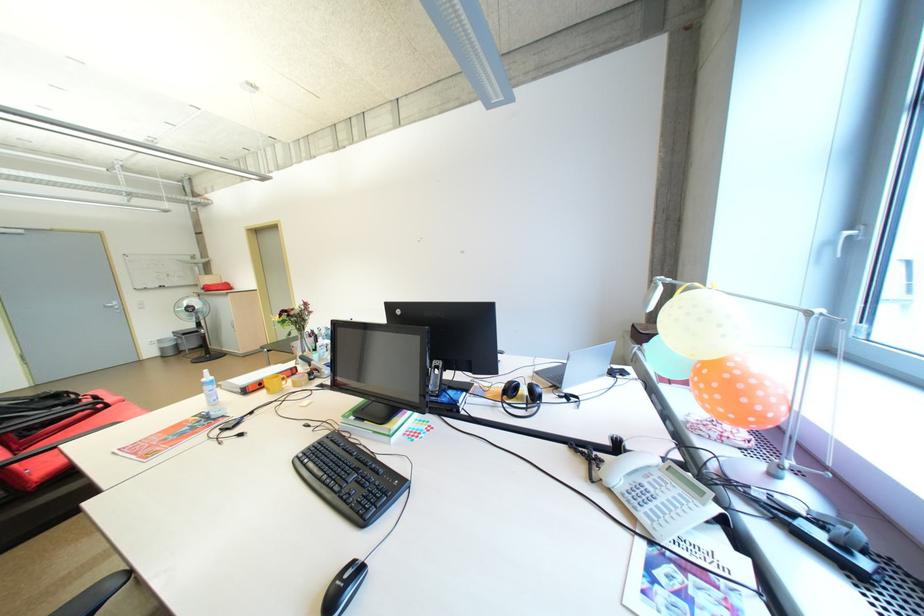
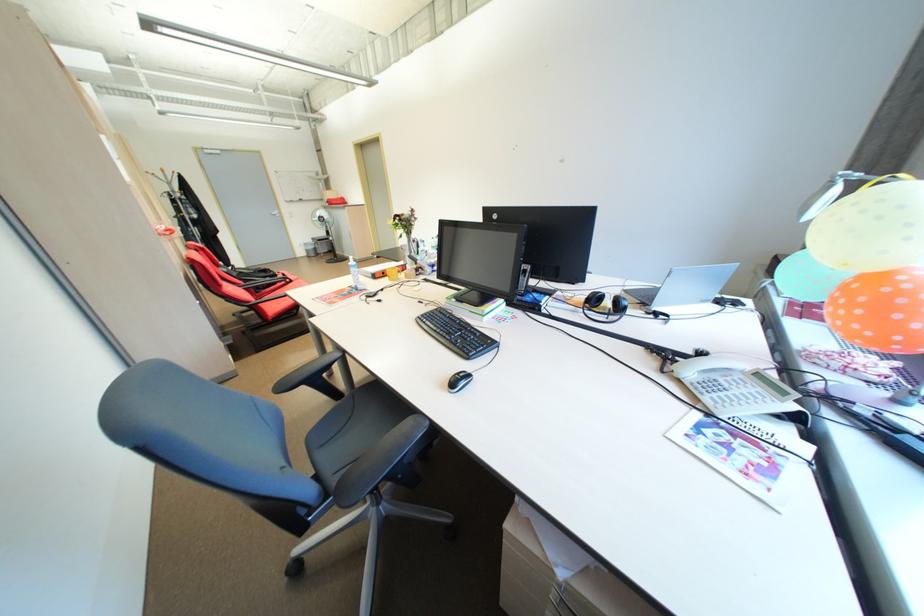
Where in the second image is the point corresponding to (532,392) from the first image?

(616, 304)